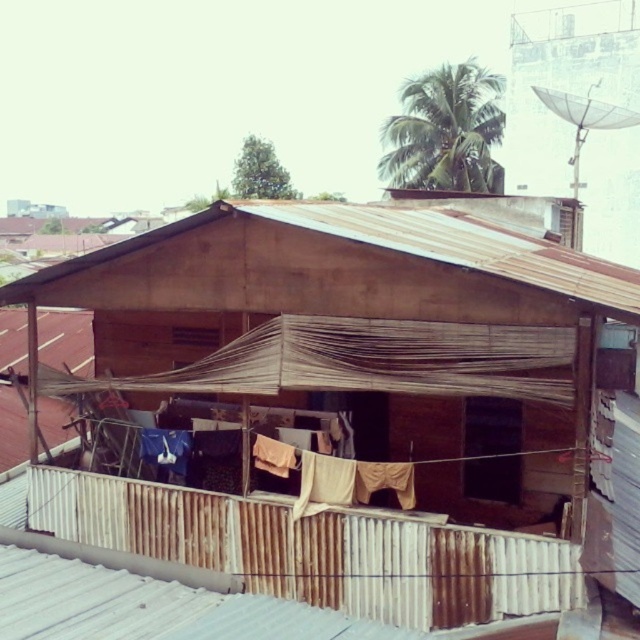
This screenshot has height=640, width=640. I want to click on brown corrugated metal hut at center, so click(x=348, y=408).

Which of these two, brown corrugated metal hut at center or brown corrugated metal roof at center, stands shorter?

brown corrugated metal roof at center is shorter.

Locate an element on the screen. This screenshot has height=640, width=640. brown corrugated metal hut at center is located at coordinates (348, 408).